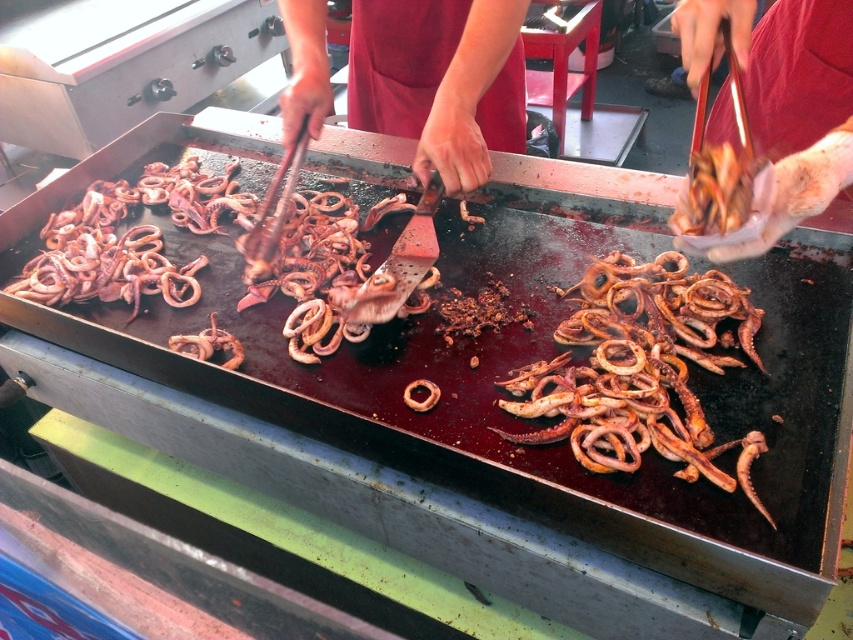
Does brown rubbery squid at center have a lesser width compared to smooth red apron at center?

In fact, brown rubbery squid at center might be wider than smooth red apron at center.

Who is more forward, (352, 220) or (701, 10)?

Point (701, 10) is in front.

In order to click on brown rubbery squid at center in this screenshot , I will do `click(131, 237)`.

Does brown crispy squid at center have a smaller size compared to red apron at center?

Indeed, brown crispy squid at center has a smaller size compared to red apron at center.

Who is higher up, brown crispy squid at center or red apron at center?

red apron at center is higher up.

Is point (650, 428) behind point (297, 20)?

No.

Locate an element on the screen. The image size is (853, 640). brown crispy squid at center is located at coordinates (640, 371).

Is brown crispy squid at center smaller than shiny golden squid at right?

Actually, brown crispy squid at center might be larger than shiny golden squid at right.

Which is above, brown crispy squid at center or shiny golden squid at right?

shiny golden squid at right is higher up.

Does point (608, 310) lie in front of point (683, 225)?

No, (608, 310) is behind (683, 225).

At what (x,y) coordinates should I click in order to perform the action: click on brown crispy squid at center. Please return your answer as a coordinate pair (x, y). Image resolution: width=853 pixels, height=640 pixels. Looking at the image, I should click on (640, 371).